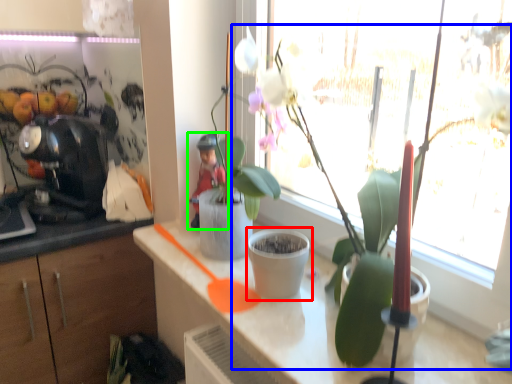
Question: Considering the real-world distances, which object is farthest from flowerpot (highlighted by a red box)? houseplant (highlighted by a blue box) or person (highlighted by a green box)?

Choices:
 (A) houseplant
 (B) person

Answer: (B)